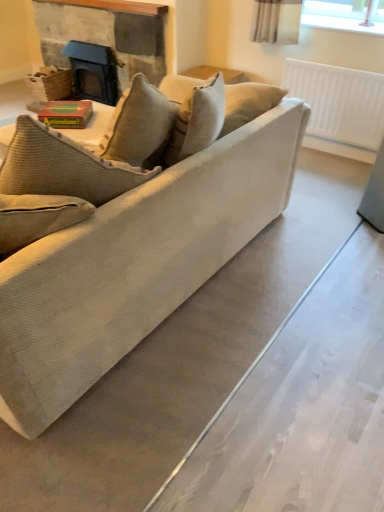
This screenshot has width=384, height=512. In order to click on vacant area that lies in front of white plastic radiator at upper right in this screenshot , I will do `click(321, 174)`.